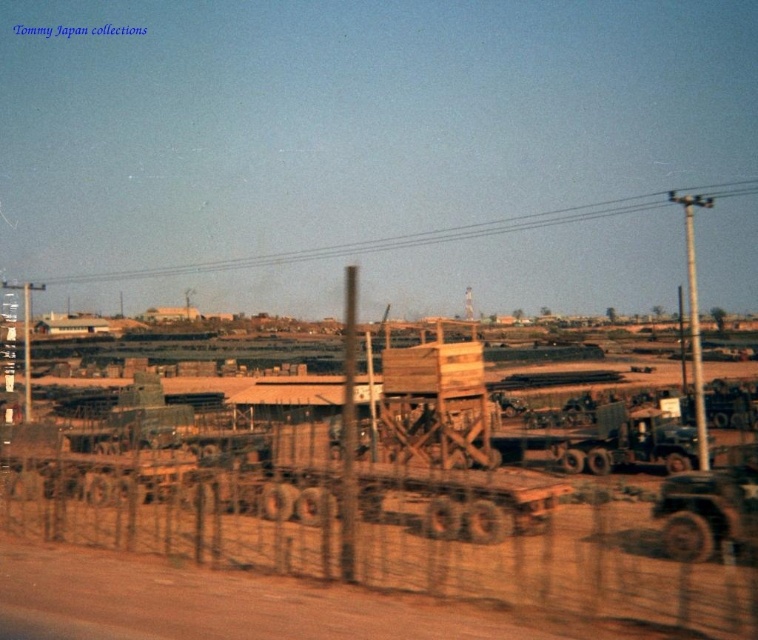
Consider the image. Can you confirm if wooden planks at center is positioned to the left of brown wire mesh fence at lower center?

In fact, wooden planks at center is to the right of brown wire mesh fence at lower center.

Between wooden planks at center and brown wire mesh fence at lower center, which one is positioned lower?

brown wire mesh fence at lower center is below.

Describe the element at coordinates (374, 524) in the screenshot. I see `wooden planks at center` at that location.

Locate an element on the screen. wooden planks at center is located at coordinates (374, 524).